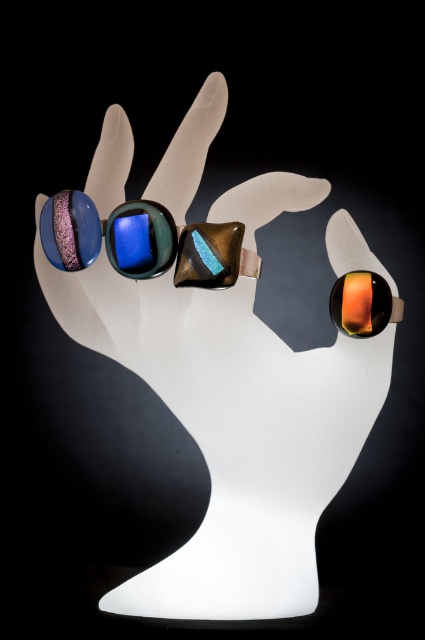
Question: Can you confirm if shiny blue glass goggles at center is positioned to the left of orange glossy ring at upper right?

Choices:
 (A) no
 (B) yes

Answer: (B)

Question: Can you confirm if shiny blue glass goggles at center is positioned to the right of orange glossy ring at upper right?

Choices:
 (A) yes
 (B) no

Answer: (B)

Question: Which of the following is the farthest from the observer?

Choices:
 (A) (198, 228)
 (B) (396, 321)

Answer: (B)

Question: Can you confirm if shiny blue glass goggles at center is wider than orange glossy ring at upper right?

Choices:
 (A) yes
 (B) no

Answer: (A)